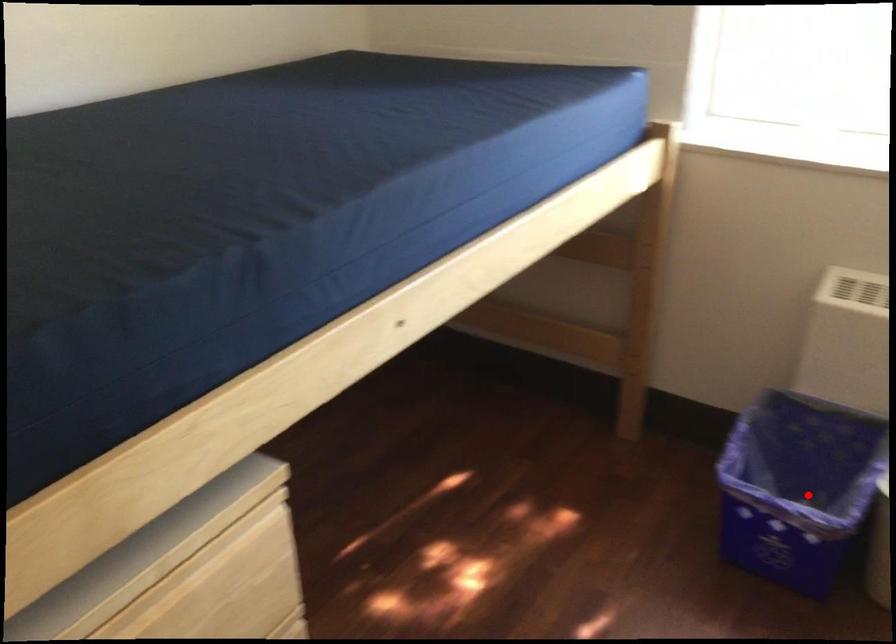
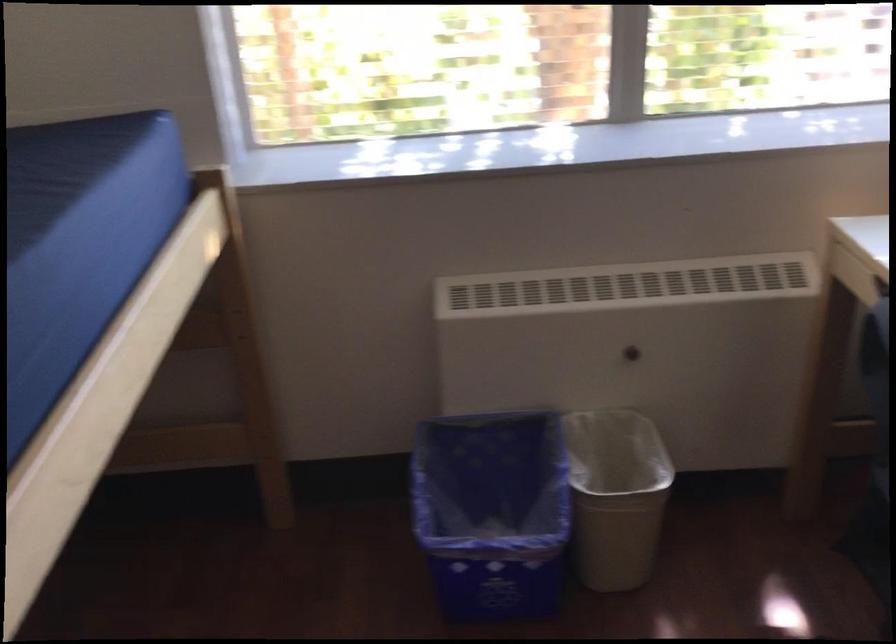
In the second image, find the point that corresponds to the highlighted location in the first image.

(492, 512)